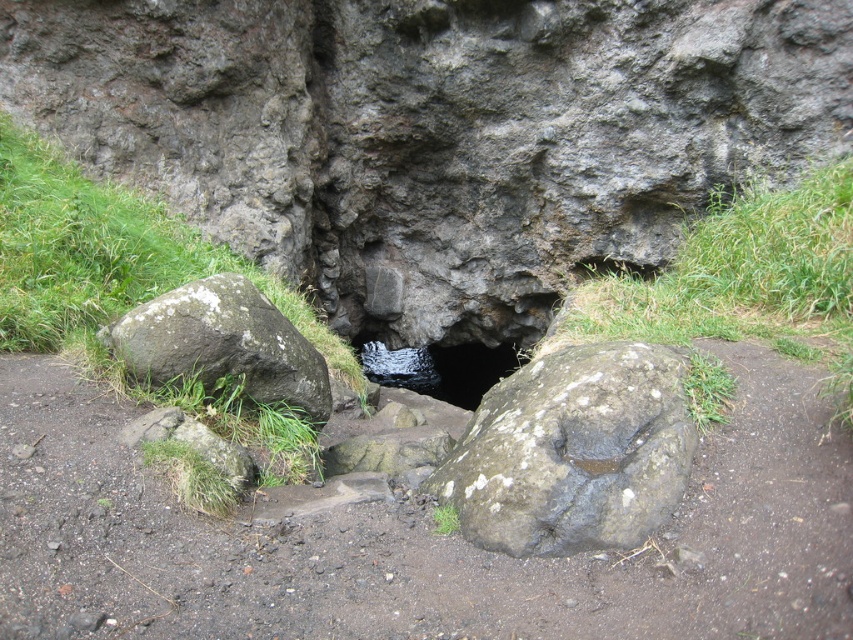
Is point (744, 580) closer to camera compared to point (679, 250)?

Yes, it is in front of point (679, 250).

Is point (733, 579) positioned behind point (798, 253)?

That is False.

Does point (654, 620) lie behind point (821, 188)?

No, (654, 620) is in front of (821, 188).

Find the location of a particular element. dull gray stone at center is located at coordinates (416, 540).

Which of these two, green grassy rock at center or black rock hole at center, stands taller?

Standing taller between the two is green grassy rock at center.

Can you confirm if green grassy rock at center is positioned to the right of black rock hole at center?

No, green grassy rock at center is not to the right of black rock hole at center.

At what (x,y) coordinates should I click in order to perform the action: click on green grassy rock at center. Please return your answer as a coordinate pair (x, y). This screenshot has height=640, width=853. Looking at the image, I should click on (106, 256).

Between point (608, 628) and point (273, 312), which one is positioned behind?

The point (273, 312) is behind.

Can you confirm if dull gray stone at center is positioned to the left of gray rough rock at left?

Incorrect, dull gray stone at center is not on the left side of gray rough rock at left.

Who is more forward, (727, 589) or (248, 397)?

Point (727, 589)

The image size is (853, 640). In order to click on dull gray stone at center in this screenshot , I will do `click(416, 540)`.